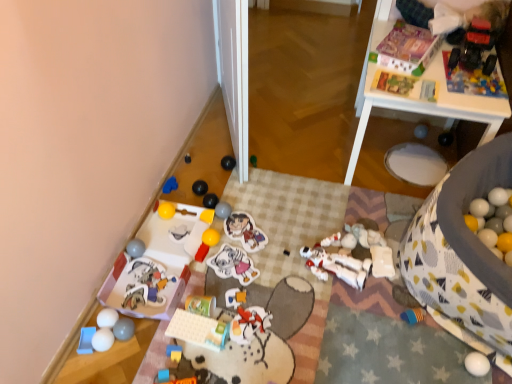
You are a GUI agent. You are given a task and a screenshot of the screen. Output one action in this format:
    pyautogui.click(x=<x>, y=<y>)
    Task: Click on the vacant area that lies in front of white matte doll at center, acting as the 5th toy starting from the right
    Image resolution: width=512 pixels, height=384 pixels.
    Given the screenshot: What is the action you would take?
    pyautogui.click(x=339, y=317)